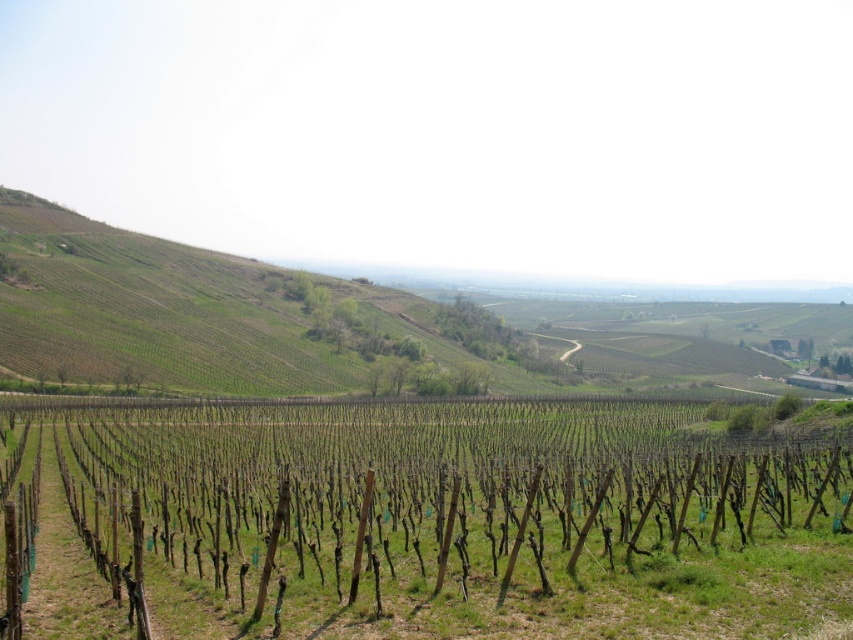
Is point (546, 424) closer to viewer compared to point (296, 273)?

Yes, it is in front of point (296, 273).

Can you confirm if green wood pole at center is thinner than green grassy hillside at upper left?

Indeed, green wood pole at center has a lesser width compared to green grassy hillside at upper left.

Does point (260, 406) come farther from viewer compared to point (352, 339)?

No.

Identify the location of green wood pole at center. (418, 522).